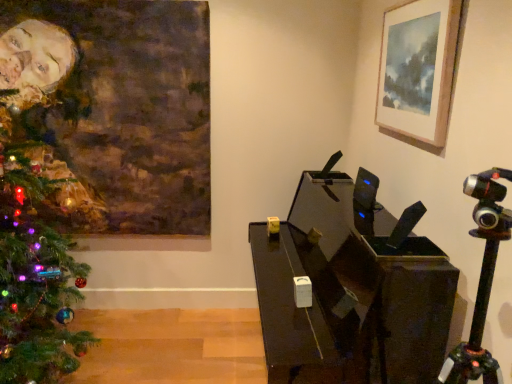
Question: From a real-world perspective, is wooden picture frame at upper right, the 2th picture frame positioned from the left, over oil painting portrait at left, the first picture frame in the back-to-front sequence?

Choices:
 (A) yes
 (B) no

Answer: (A)

Question: Is wooden picture frame at upper right, placed as the 2th picture frame when sorted from back to front, with oil painting portrait at left, which appears as the second picture frame when viewed from the front?

Choices:
 (A) yes
 (B) no

Answer: (B)

Question: Is there a large distance between wooden picture frame at upper right, marked as the 1th picture frame in a front-to-back arrangement, and oil painting portrait at left, which appears as the second picture frame when viewed from the front?

Choices:
 (A) no
 (B) yes

Answer: (B)

Question: Considering the relative sizes of wooden picture frame at upper right, positioned as the first picture frame in right-to-left order, and oil painting portrait at left, acting as the 1th picture frame starting from the left, in the image provided, is wooden picture frame at upper right, positioned as the first picture frame in right-to-left order, thinner than oil painting portrait at left, acting as the 1th picture frame starting from the left,?

Choices:
 (A) yes
 (B) no

Answer: (A)

Question: Is wooden picture frame at upper right, placed as the 2th picture frame when sorted from back to front, positioned before oil painting portrait at left, which appears as the second picture frame when viewed from the front?

Choices:
 (A) yes
 (B) no

Answer: (A)

Question: Is oil painting portrait at left, acting as the 1th picture frame starting from the left, bigger or smaller than wooden picture frame at upper right, marked as the 1th picture frame in a front-to-back arrangement?

Choices:
 (A) small
 (B) big

Answer: (B)

Question: Relative to wooden picture frame at upper right, marked as the 1th picture frame in a front-to-back arrangement, is oil painting portrait at left, the 2th picture frame in the right-to-left sequence, in front or behind?

Choices:
 (A) behind
 (B) front

Answer: (A)

Question: Is oil painting portrait at left, the 2th picture frame in the right-to-left sequence, spatially inside wooden picture frame at upper right, placed as the 2th picture frame when sorted from back to front, or outside of it?

Choices:
 (A) outside
 (B) inside

Answer: (A)

Question: In terms of height, does oil painting portrait at left, which appears as the second picture frame when viewed from the front, look taller or shorter compared to wooden picture frame at upper right, marked as the 1th picture frame in a front-to-back arrangement?

Choices:
 (A) short
 (B) tall

Answer: (B)

Question: In terms of size, does green matte christmas tree at left appear bigger or smaller than wooden picture frame at upper right, positioned as the first picture frame in right-to-left order?

Choices:
 (A) big
 (B) small

Answer: (A)

Question: Is green matte christmas tree at left in front of or behind wooden picture frame at upper right, the 2th picture frame positioned from the left, in the image?

Choices:
 (A) behind
 (B) front

Answer: (B)

Question: From a real-world perspective, is green matte christmas tree at left above or below wooden picture frame at upper right, the 2th picture frame positioned from the left?

Choices:
 (A) below
 (B) above

Answer: (A)

Question: Looking at their shapes, would you say green matte christmas tree at left is wider or thinner than wooden picture frame at upper right, placed as the 2th picture frame when sorted from back to front?

Choices:
 (A) thin
 (B) wide

Answer: (B)

Question: In terms of width, does green matte christmas tree at left look wider or thinner when compared to oil painting portrait at left, which appears as the second picture frame when viewed from the front?

Choices:
 (A) wide
 (B) thin

Answer: (A)

Question: From the image's perspective, is green matte christmas tree at left positioned above or below oil painting portrait at left, the first picture frame in the back-to-front sequence?

Choices:
 (A) above
 (B) below

Answer: (B)